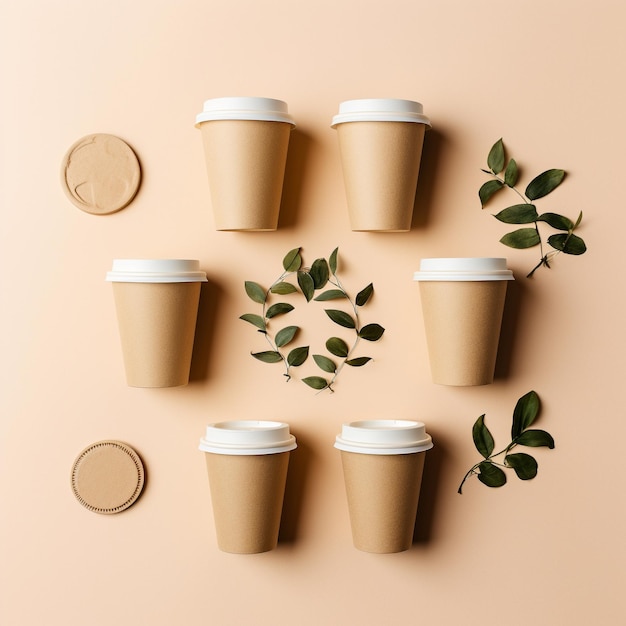
The width and height of the screenshot is (626, 626). In order to click on cups to sip coffee in this screenshot , I will do click(x=255, y=493), click(x=394, y=478), click(x=476, y=309), click(x=377, y=198), click(x=269, y=161), click(x=170, y=336).